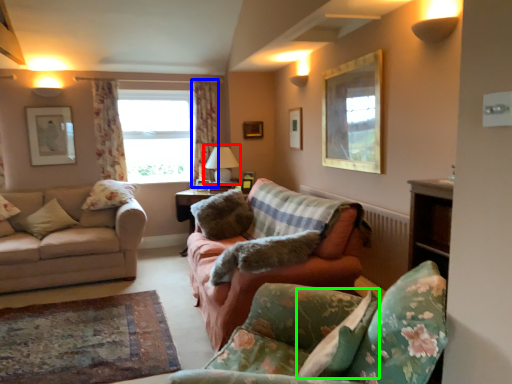
Question: Which object is the closest to the table lamp (highlighted by a red box)? Choose among these: curtain (highlighted by a blue box) or pillow (highlighted by a green box).

Choices:
 (A) curtain
 (B) pillow

Answer: (A)